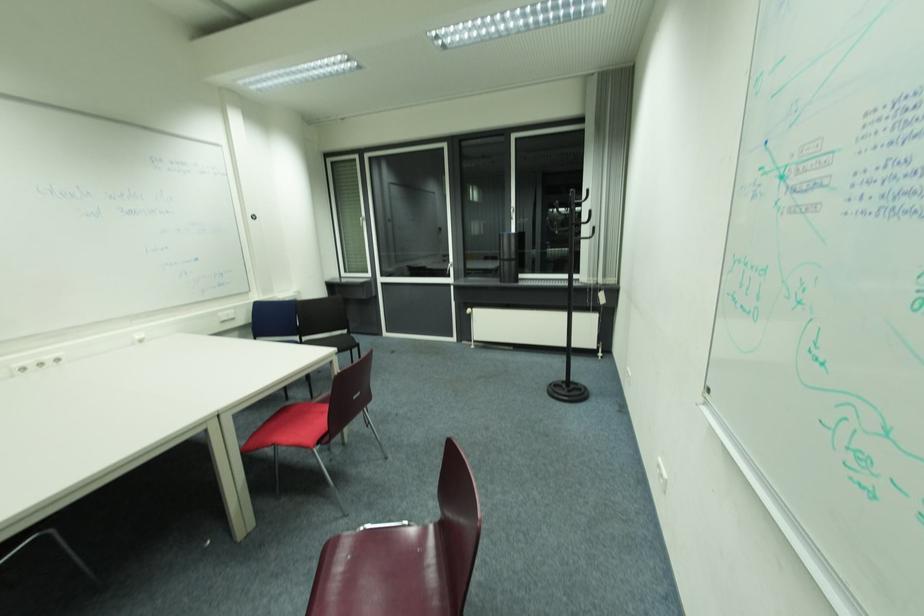
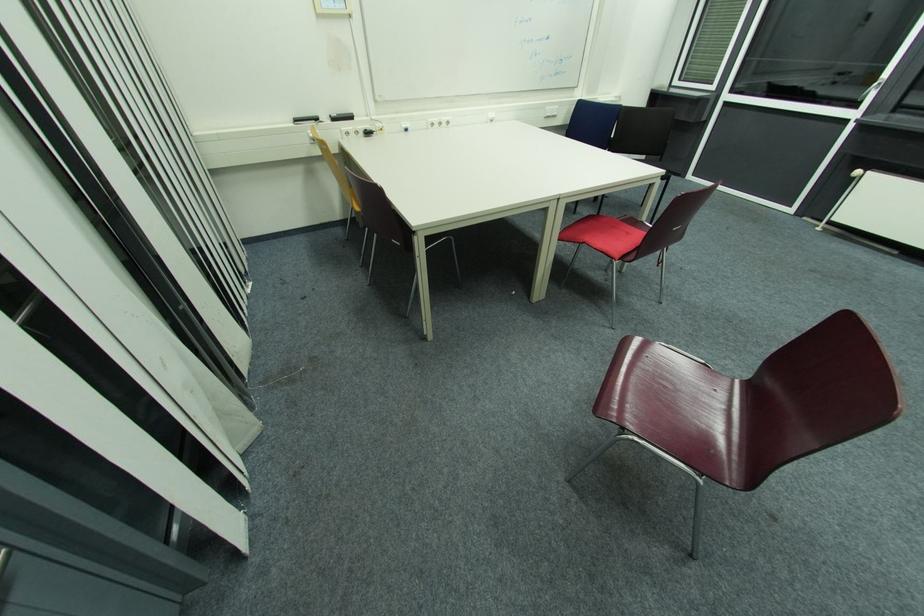
Where in the second image is the point corresponding to the point at 454,265 from the first image?

(880, 84)